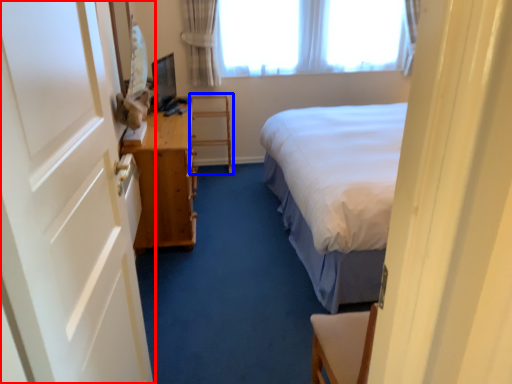
Question: Which object is further to the camera taking this photo, door (highlighted by a red box) or furniture (highlighted by a blue box)?

Choices:
 (A) door
 (B) furniture

Answer: (B)